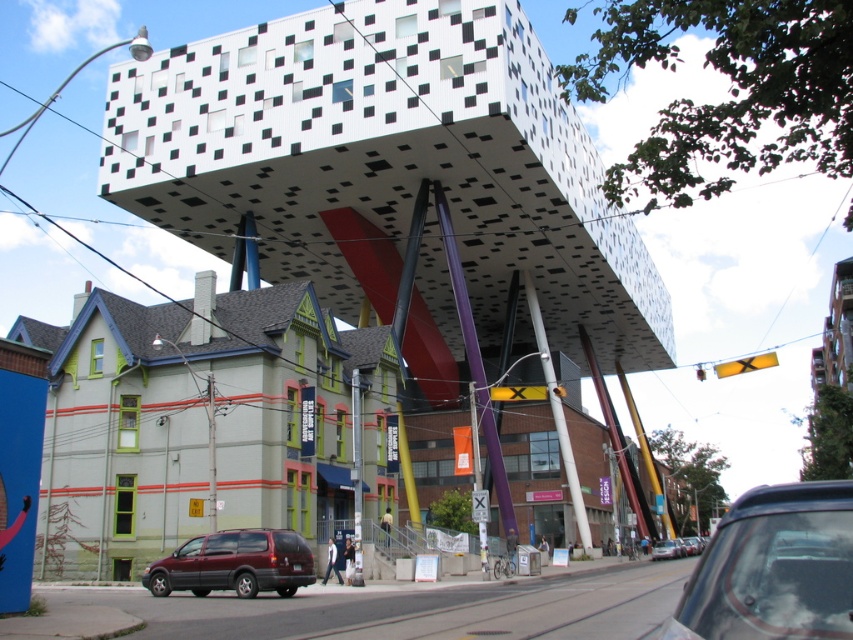
Which is more to the left, white textured cube at upper center or matte black car at lower right?

Positioned to the left is matte black car at lower right.

Does point (154, 221) come farther from viewer compared to point (775, 579)?

Yes, it is.

At what (x,y) coordinates should I click in order to perform the action: click on white textured cube at upper center. Please return your answer as a coordinate pair (x, y). Image resolution: width=853 pixels, height=640 pixels. Looking at the image, I should click on (393, 180).

Which is above, matte black car at lower right or metallic silver car at center?

matte black car at lower right

Image resolution: width=853 pixels, height=640 pixels. Find the location of `matte black car at lower right`. matte black car at lower right is located at coordinates (773, 568).

Is point (155, 577) farther from viewer compared to point (656, 541)?

That is False.

Which is above, maroon matte suv at lower left or metallic silver car at center?

maroon matte suv at lower left is higher up.

Between point (242, 572) and point (666, 547), which one is positioned behind?

The point (666, 547) is behind.

Where is `maroon matte suv at lower left`? maroon matte suv at lower left is located at coordinates (234, 563).